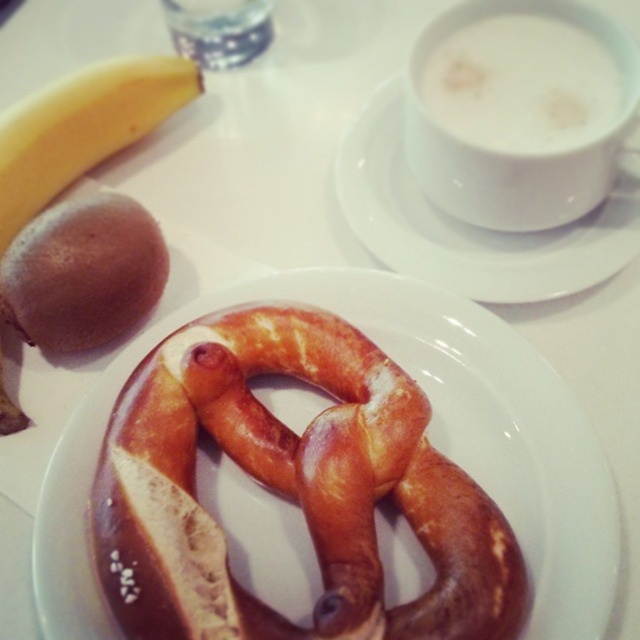
Question: Is golden brown pretzel at center further to the viewer compared to white matte cup at upper center?

Choices:
 (A) yes
 (B) no

Answer: (B)

Question: Is golden brown pretzel at center positioned before white frothy coffee at upper right?

Choices:
 (A) yes
 (B) no

Answer: (A)

Question: Which point is closer to the camera?

Choices:
 (A) yellow matte banana at upper left
 (B) white frothy coffee at upper right
 (C) golden brown pretzel at center

Answer: (C)

Question: Among these objects, which one is nearest to the camera?

Choices:
 (A) white matte cup at upper center
 (B) white frothy coffee at upper right
 (C) yellow matte banana at upper left
 (D) translucent plastic bottle at upper center

Answer: (B)

Question: Can you confirm if golden brown pretzel at center is bigger than white frothy coffee at upper right?

Choices:
 (A) yes
 (B) no

Answer: (A)

Question: Which object is positioned closest to the yellow matte banana at upper left?

Choices:
 (A) golden brown pretzel at center
 (B) white matte cup at upper center

Answer: (A)